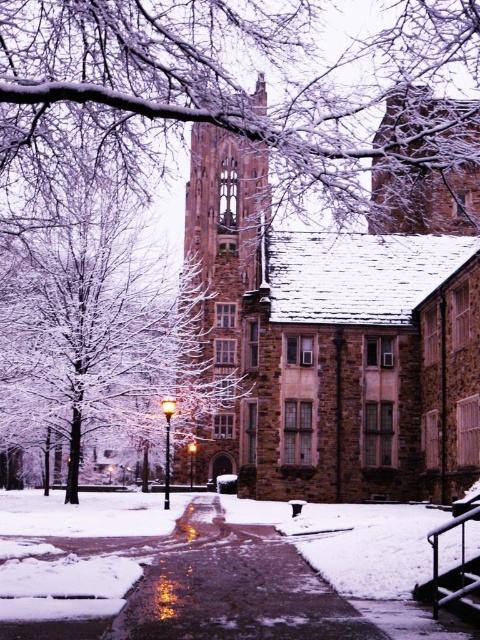
You are standing at the entrance of the university campus and want to reach the brown stone church at center. According to the map, the coordinates of the church are at point 0.523, 0.704. If you are currently at the origin point 0,0, in which general direction should you head to reach the church?

The brown stone church at center is located at point (x=337, y=333), so you should head northeast to reach it since both the x and y coordinates are positive and increasing from the origin.